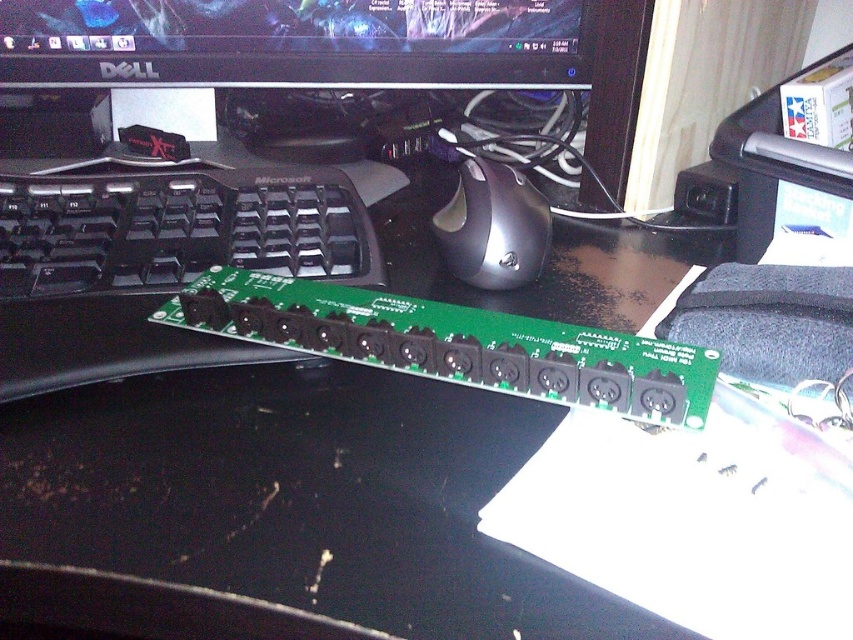
In the scene shown: You are setting up a new computer desk and need to place a mouse between the black glossy monitor at upper center and the black matte keyboard at left. Based on their positions, where should you place the mouse relative to the keyboard?

The black glossy monitor at upper center is positioned on the right side of the black matte keyboard at left, so you should place the mouse to the right of the black matte keyboard at left to position it between them.

You are setting up a new computer desk and want to place a wireless charger between the black matte keyboard at left and the black matte mouse at center. The wireless charger has a diameter of 10 centimeters. Can the charger fit between them without overlapping either device?

The distance between the black matte keyboard at left and the black matte mouse at center is 13.71 centimeters. Since the charger requires 10 centimeters of space, there is enough room for it to fit between them without overlapping either device.